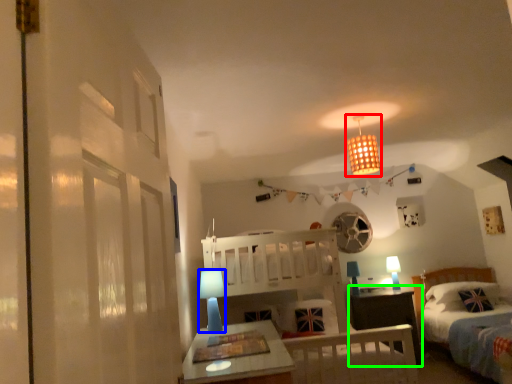
Question: Considering the real-world distances, which object is closest to light fixture (highlighted by a red box)? table lamp (highlighted by a blue box) or nightstand (highlighted by a green box).

Choices:
 (A) table lamp
 (B) nightstand

Answer: (A)